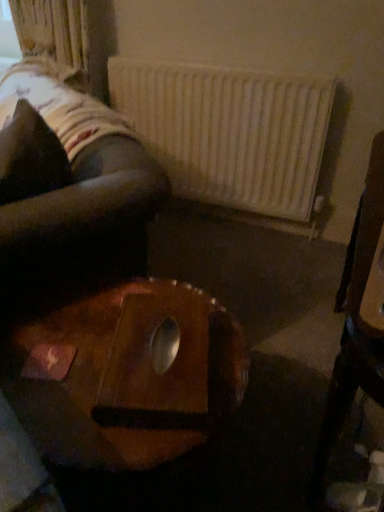
I want to click on free spot above wooden table at center (from a real-world perspective), so click(104, 348).